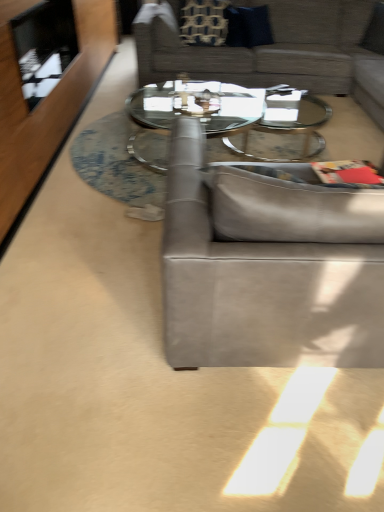
Question: From a real-world perspective, is suede gray couch at center, placed as the 1th studio couch when sorted from bottom to top, physically located above or below clear glass coffee table at center?

Choices:
 (A) above
 (B) below

Answer: (A)

Question: Would you say suede gray couch at center, which is the 1th studio couch in front-to-back order, is to the left or to the right of clear glass coffee table at center in the picture?

Choices:
 (A) left
 (B) right

Answer: (B)

Question: Based on their relative distances, which object is farther from the patterned fabric pillow at upper center, marked as the second pillow in a right-to-left arrangement?

Choices:
 (A) dark blue fabric pillow at upper center, placed as the first pillow when sorted from right to left
 (B) clear glass coffee table at center
 (C) suede gray couch at center, which is the 2th studio couch from back to front
 (D) textured gray couch at upper center, marked as the first studio couch in a top-to-bottom arrangement

Answer: (C)

Question: Estimate the real-world distances between objects in this image. Which object is farther from the patterned fabric pillow at upper center, arranged as the first pillow when viewed from the left?

Choices:
 (A) suede gray couch at center, which is the 2th studio couch from back to front
 (B) dark blue fabric pillow at upper center, the second pillow from the left
 (C) clear glass coffee table at center
 (D) textured gray couch at upper center, which is the second studio couch in front-to-back order

Answer: (A)